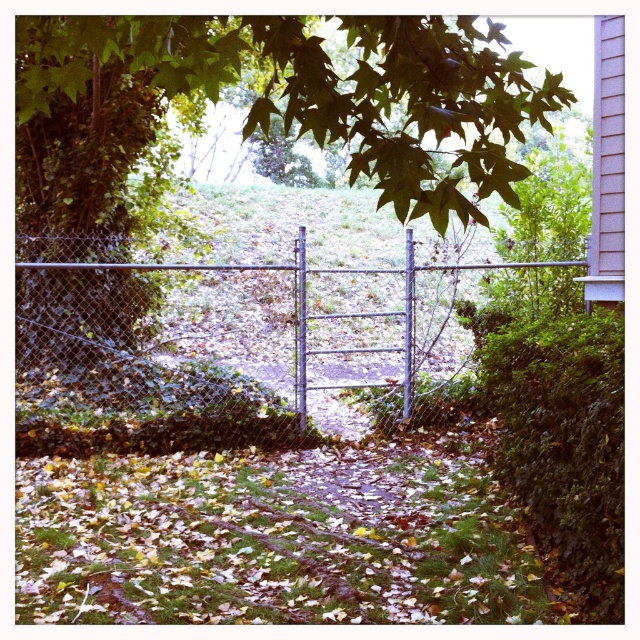
Image resolution: width=640 pixels, height=640 pixels. Describe the element at coordinates (317, 90) in the screenshot. I see `green leafy tree at center` at that location.

Is green leafy tree at center in front of metallic chain-link fence at center?

That is True.

Where is `green leafy tree at center`? The image size is (640, 640). green leafy tree at center is located at coordinates (317, 90).

The width and height of the screenshot is (640, 640). Describe the element at coordinates (561, 436) in the screenshot. I see `green leafy hedge at right` at that location.

Can you confirm if green leafy hedge at right is positioned to the left of metallic chain-link fence at center?

No, green leafy hedge at right is not to the left of metallic chain-link fence at center.

Does point (596, 404) come farther from viewer compared to point (305, 346)?

No, it is in front of (305, 346).

This screenshot has height=640, width=640. Identify the location of green leafy hedge at right. (561, 436).

Can you confirm if green leafy tree at center is positioned below green leafy hedge at right?

No, green leafy tree at center is not below green leafy hedge at right.

What are the coordinates of `green leafy tree at center` in the screenshot? It's located at (317, 90).